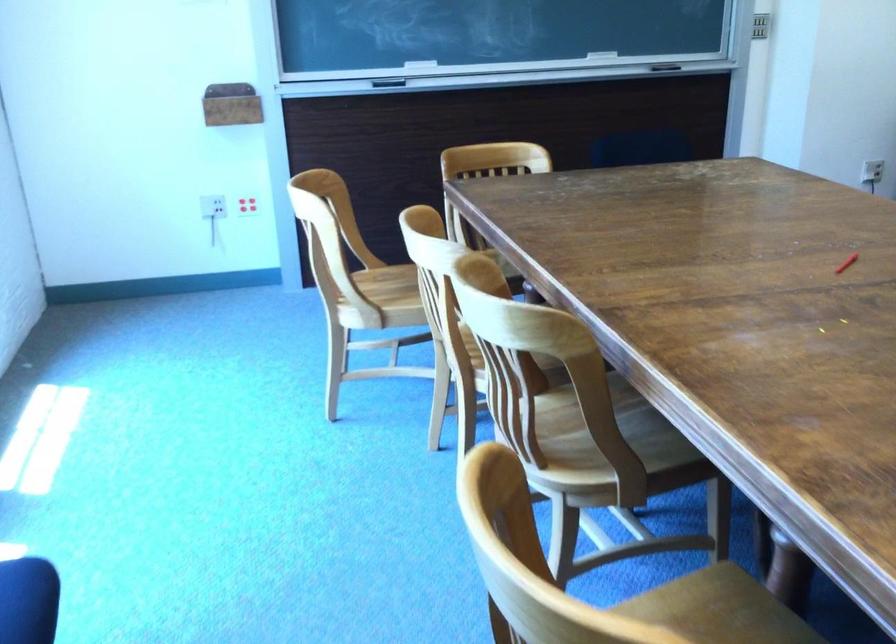
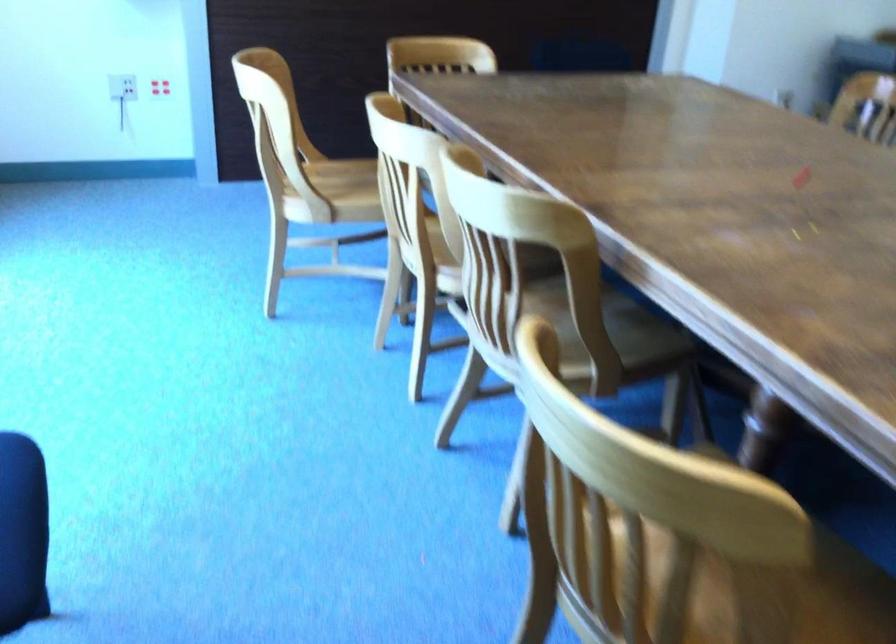
Find the pixel in the second image that matches point (221, 210) in the first image.

(122, 87)